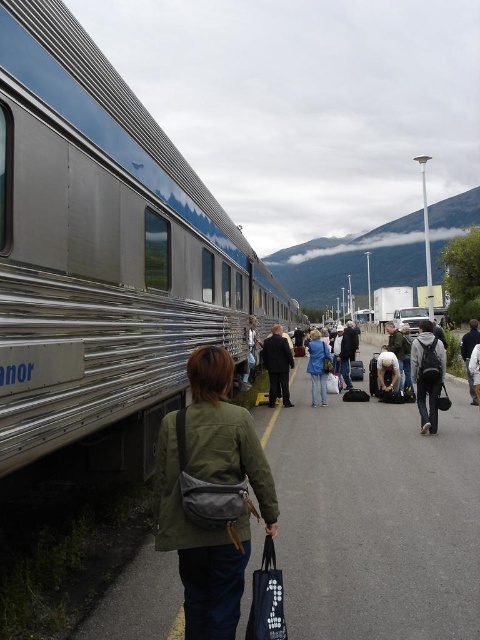
Between blue denim jeans at center and dark blue jeans at center, which one has more height?

Standing taller between the two is dark blue jeans at center.

Is blue denim jeans at center positioned in front of dark blue jeans at center?

Yes, it is.

The image size is (480, 640). What do you see at coordinates (317, 365) in the screenshot?
I see `blue denim jeans at center` at bounding box center [317, 365].

Identify the location of blue denim jeans at center. (317, 365).

Can you confirm if dark blue jeans at center is bigger than dark gray jacket at right?

Indeed, dark blue jeans at center has a larger size compared to dark gray jacket at right.

Does dark blue jeans at center appear over dark gray jacket at right?

Incorrect, dark blue jeans at center is not positioned above dark gray jacket at right.

The height and width of the screenshot is (640, 480). In order to click on dark blue jeans at center in this screenshot , I will do `click(348, 352)`.

Does green fabric bag at lower center have a greater height compared to dark gray suit at center?

In fact, green fabric bag at lower center may be shorter than dark gray suit at center.

Who is positioned more to the right, green fabric bag at lower center or dark gray suit at center?

From the viewer's perspective, dark gray suit at center appears more on the right side.

Find the location of a particular element. This screenshot has height=640, width=480. green fabric bag at lower center is located at coordinates (213, 483).